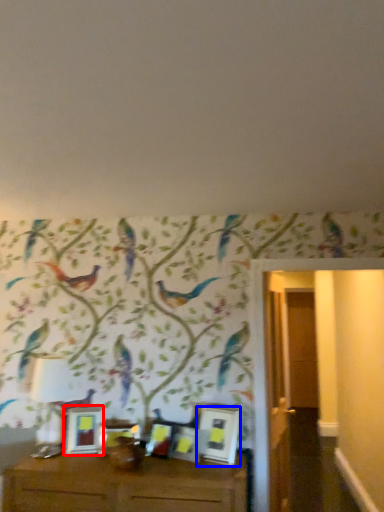
Question: Among these objects, which one is nearest to the camera, picture frame (highlighted by a red box) or picture frame (highlighted by a blue box)?

Choices:
 (A) picture frame
 (B) picture frame

Answer: (B)